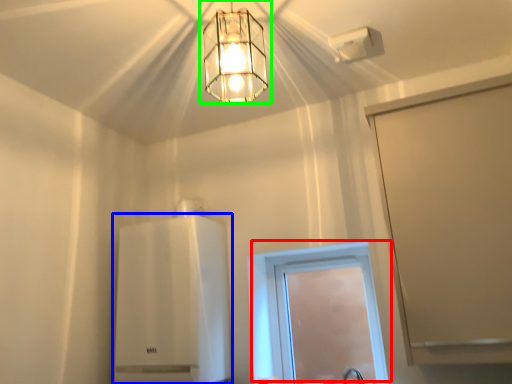
Question: Based on their relative distances, which object is farther from window (highlighted by a red box)? Choose from appliance (highlighted by a blue box) and lamp (highlighted by a green box).

Choices:
 (A) appliance
 (B) lamp

Answer: (B)